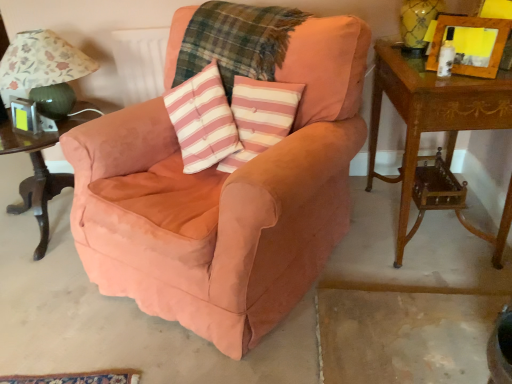
Find the location of a particular element. wooden carved side table at right, the first table viewed from the right is located at coordinates (430, 116).

Locate an element on the screen. floral fabric lampshade at left is located at coordinates (44, 70).

What do you see at coordinates (474, 27) in the screenshot? The image size is (512, 384). I see `wooden picture frame at upper right, which is counted as the 1th picture frame, starting from the right` at bounding box center [474, 27].

Find the location of a particular element. wooden carved side table at right, arranged as the 2th table when viewed from the left is located at coordinates (430, 116).

Are wooden carved side table at right, arranged as the 2th table when viewed from the left, and pink striped fabric pillow at center far apart?

No, there isn't a large distance between wooden carved side table at right, arranged as the 2th table when viewed from the left, and pink striped fabric pillow at center.

Is wooden carved side table at right, arranged as the 2th table when viewed from the left, positioned behind pink striped fabric pillow at center?

No, wooden carved side table at right, arranged as the 2th table when viewed from the left, is in front of pink striped fabric pillow at center.

Considering the points (408, 136) and (297, 92), which point is behind, point (408, 136) or point (297, 92)?

Positioned behind is point (297, 92).

Is wooden picture frame at upper right, the second picture frame from the bottom, touching suede-like peach armchair at center?

No, wooden picture frame at upper right, the second picture frame from the bottom, is not touching suede-like peach armchair at center.

Considering the sizes of wooden picture frame at upper right, the second picture frame from the bottom, and suede-like peach armchair at center in the image, is wooden picture frame at upper right, the second picture frame from the bottom, bigger or smaller than suede-like peach armchair at center?

Considering their sizes, wooden picture frame at upper right, the second picture frame from the bottom, takes up less space than suede-like peach armchair at center.

From the image's perspective, is wooden picture frame at upper right, which appears as the 2th picture frame when viewed from the back, positioned above or below suede-like peach armchair at center?

Based on their image positions, wooden picture frame at upper right, which appears as the 2th picture frame when viewed from the back, is located above suede-like peach armchair at center.

Which object is more forward, wooden picture frame at upper right, the second picture frame from the bottom, or suede-like peach armchair at center?

suede-like peach armchair at center is in front.

Based on the photo, in terms of size, does suede-like peach armchair at center appear bigger or smaller than wooden carved side table at right, arranged as the 2th table when viewed from the left?

suede-like peach armchair at center is bigger than wooden carved side table at right, arranged as the 2th table when viewed from the left.

From the picture: From a real-world perspective, between suede-like peach armchair at center and wooden carved side table at right, arranged as the 2th table when viewed from the left, who is vertically lower?

In real-world perspective, wooden carved side table at right, arranged as the 2th table when viewed from the left, is lower.

Which object is thinner, suede-like peach armchair at center or wooden carved side table at right, the first table viewed from the right?

wooden carved side table at right, the first table viewed from the right.

Does point (495, 62) come closer to viewer compared to point (13, 107)?

Yes, it is.

Is wooden picture frame at upper right, which is the 1th picture frame in front-to-back order, oriented towards metallic silver picture frame at left, acting as the second picture frame starting from the front?

No.

Is wooden picture frame at upper right, the second picture frame from the bottom, taller than metallic silver picture frame at left, arranged as the 1th picture frame when viewed from the back?

Yes.

This screenshot has height=384, width=512. What are the coordinates of `throw pillow located below the plaid fabric at center (from the image's perspective)` in the screenshot? It's located at (260, 117).

From the image's perspective, which object appears higher, plaid fabric at center or pink striped fabric pillow at center?

plaid fabric at center is shown above in the image.

From the picture: Is plaid fabric at center at the right side of pink striped fabric pillow at center?

In fact, plaid fabric at center is to the left of pink striped fabric pillow at center.

Relative to pink striped fabric pillow at center, is plaid fabric at center in front or behind?

plaid fabric at center is positioned farther from the viewer than pink striped fabric pillow at center.

Considering the sizes of objects metallic silver picture frame at left, the 1th picture frame in the left-to-right sequence, and wooden carved side table at right, arranged as the 2th table when viewed from the left, in the image provided, who is thinner, metallic silver picture frame at left, the 1th picture frame in the left-to-right sequence, or wooden carved side table at right, arranged as the 2th table when viewed from the left,?

metallic silver picture frame at left, the 1th picture frame in the left-to-right sequence, is thinner.

Would you say wooden carved side table at right, arranged as the 2th table when viewed from the left, is part of metallic silver picture frame at left, which is counted as the second picture frame, starting from the right,'s contents?

No, wooden carved side table at right, arranged as the 2th table when viewed from the left, is not inside metallic silver picture frame at left, which is counted as the second picture frame, starting from the right.

Considering the sizes of objects metallic silver picture frame at left, which appears as the second picture frame when viewed from the top, and wooden carved side table at right, the first table viewed from the right, in the image provided, who is bigger, metallic silver picture frame at left, which appears as the second picture frame when viewed from the top, or wooden carved side table at right, the first table viewed from the right,?

Bigger between the two is wooden carved side table at right, the first table viewed from the right.

Based on the photo, considering the relative positions of suede-like peach armchair at center and wooden picture frame at upper right, the second picture frame from the bottom, in the image provided, is suede-like peach armchair at center in front of wooden picture frame at upper right, the second picture frame from the bottom,?

Yes, it is in front of wooden picture frame at upper right, the second picture frame from the bottom.

Is suede-like peach armchair at center looking in the opposite direction of wooden picture frame at upper right, which is the 1th picture frame in front-to-back order?

No.

Between suede-like peach armchair at center and wooden picture frame at upper right, the first picture frame in the top-to-bottom sequence, which one appears on the left side from the viewer's perspective?

suede-like peach armchair at center is more to the left.

Where is `throw pillow positioned vertically above the wooden carved side table at right, arranged as the 2th table when viewed from the left (from a real-world perspective)`? The height and width of the screenshot is (384, 512). throw pillow positioned vertically above the wooden carved side table at right, arranged as the 2th table when viewed from the left (from a real-world perspective) is located at coordinates (260, 117).

Image resolution: width=512 pixels, height=384 pixels. In order to click on the 2nd picture frame positioned above the suede-like peach armchair at center (from the image's perspective) in this screenshot , I will do `click(474, 27)`.

Estimate the real-world distances between objects in this image. Which object is further from dark wood table at left, which ranks as the 1th table in left-to-right order, wooden picture frame at upper right, the first picture frame in the top-to-bottom sequence, or plaid fabric at center?

Based on the image, wooden picture frame at upper right, the first picture frame in the top-to-bottom sequence, appears to be further to dark wood table at left, which ranks as the 1th table in left-to-right order.

Based on their spatial positions, is suede-like peach armchair at center or plaid fabric at center further from metallic silver picture frame at left, which appears as the second picture frame when viewed from the top?

suede-like peach armchair at center is further to metallic silver picture frame at left, which appears as the second picture frame when viewed from the top.

Estimate the real-world distances between objects in this image. Which object is closer to wooden picture frame at upper right, the first picture frame in the top-to-bottom sequence, pink striped fabric pillow at center or wooden carved side table at right, the first table viewed from the right?

wooden carved side table at right, the first table viewed from the right, is closer to wooden picture frame at upper right, the first picture frame in the top-to-bottom sequence.

Considering their positions, is suede-like peach armchair at center positioned closer to floral fabric lampshade at left than metallic silver picture frame at left, which appears as the second picture frame when viewed from the top?

metallic silver picture frame at left, which appears as the second picture frame when viewed from the top, is positioned closer to the anchor floral fabric lampshade at left.

From the image, which object appears to be nearer to wooden picture frame at upper right, which is the 1th picture frame in front-to-back order, metallic silver picture frame at left, arranged as the 1th picture frame when viewed from the back, or plaid fabric at center?

plaid fabric at center.

When comparing their distances from dark wood table at left, arranged as the second table when viewed from the right, does wooden carved side table at right, the first table viewed from the right, or pink striped fabric pillow at center seem closer?

Based on the image, pink striped fabric pillow at center appears to be nearer to dark wood table at left, arranged as the second table when viewed from the right.

Based on their spatial positions, is suede-like peach armchair at center or metallic silver picture frame at left, acting as the second picture frame starting from the front, closer to pink striped fabric pillow at center?

suede-like peach armchair at center is positioned closer to the anchor pink striped fabric pillow at center.

From the image, which object appears to be farther from wooden picture frame at upper right, which appears as the 2th picture frame when viewed from the back, plaid fabric at center or suede-like peach armchair at center?

Result: suede-like peach armchair at center.

The width and height of the screenshot is (512, 384). Find the location of `picture frame between dark wood table at left, arranged as the second table when viewed from the right, and wooden picture frame at upper right, the first picture frame in the top-to-bottom sequence`. picture frame between dark wood table at left, arranged as the second table when viewed from the right, and wooden picture frame at upper right, the first picture frame in the top-to-bottom sequence is located at coordinates (25, 116).

This screenshot has height=384, width=512. In order to click on picture frame between suede-like peach armchair at center and wooden carved side table at right, arranged as the 2th table when viewed from the left in this screenshot , I will do `click(474, 27)`.

Locate an element on the screen. throw pillow between floral fabric lampshade at left and wooden picture frame at upper right, which appears as the 2th picture frame when viewed from the back, in the horizontal direction is located at coordinates (260, 117).

Find the location of a particular element. Image resolution: width=512 pixels, height=384 pixels. chair between metallic silver picture frame at left, which appears as the second picture frame when viewed from the top, and plaid fabric at center is located at coordinates (224, 201).